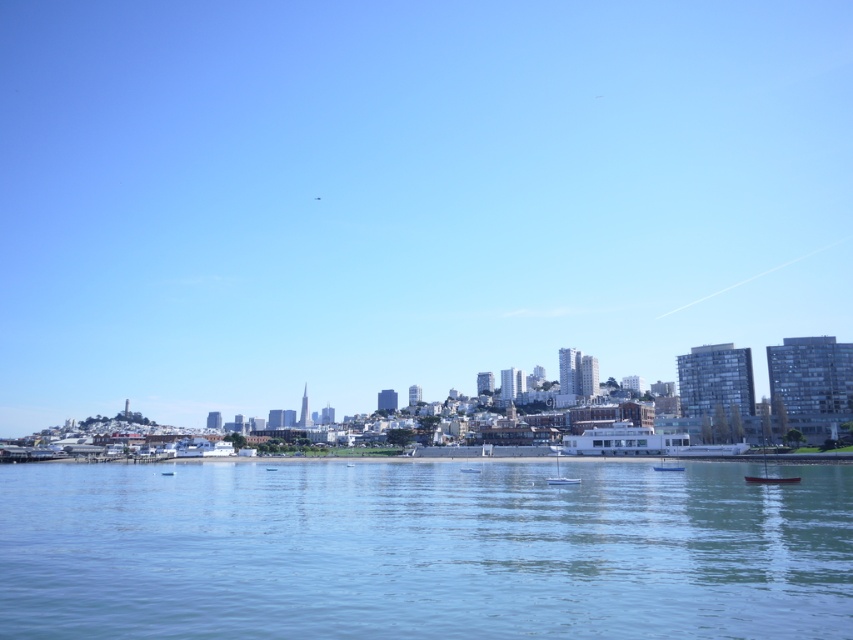
Question: Which point appears closest to the camera in this image?

Choices:
 (A) (73, 618)
 (B) (683, 467)

Answer: (A)

Question: Which object is positioned farthest from the white glossy boat at lower center?

Choices:
 (A) transparent glass skyline at center
 (B) clear blue water at center
 (C) white glossy boat at center

Answer: (A)

Question: Does clear blue water at center appear on the left side of white glossy boat at center?

Choices:
 (A) yes
 (B) no

Answer: (A)

Question: Which of the following is the farthest from the observer?

Choices:
 (A) (558, 454)
 (B) (445, 33)
 (C) (683, 467)

Answer: (B)

Question: Does transparent glass skyline at center have a larger size compared to white glossy boat at lower center?

Choices:
 (A) yes
 (B) no

Answer: (A)

Question: Is the position of clear blue water at center more distant than that of white glossy boat at center?

Choices:
 (A) yes
 (B) no

Answer: (B)